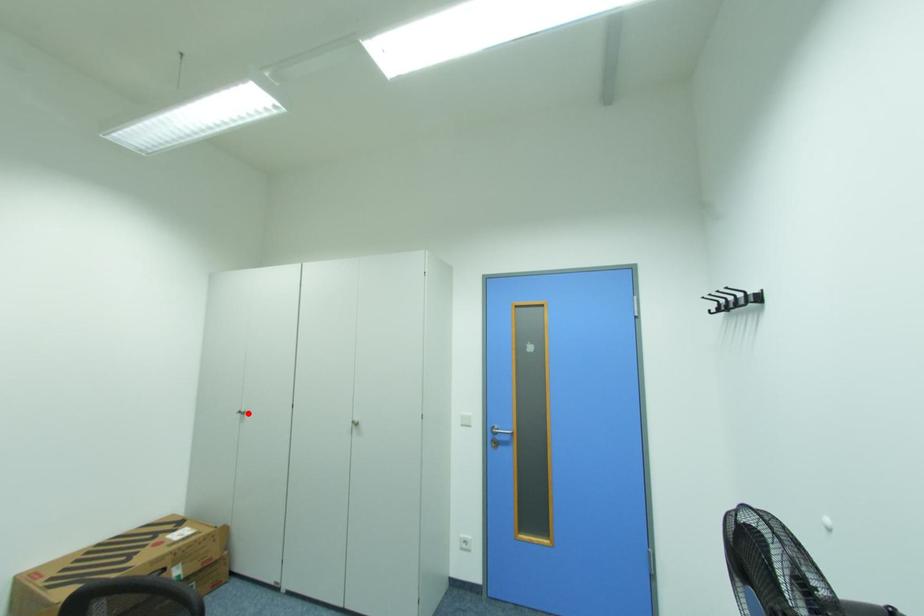
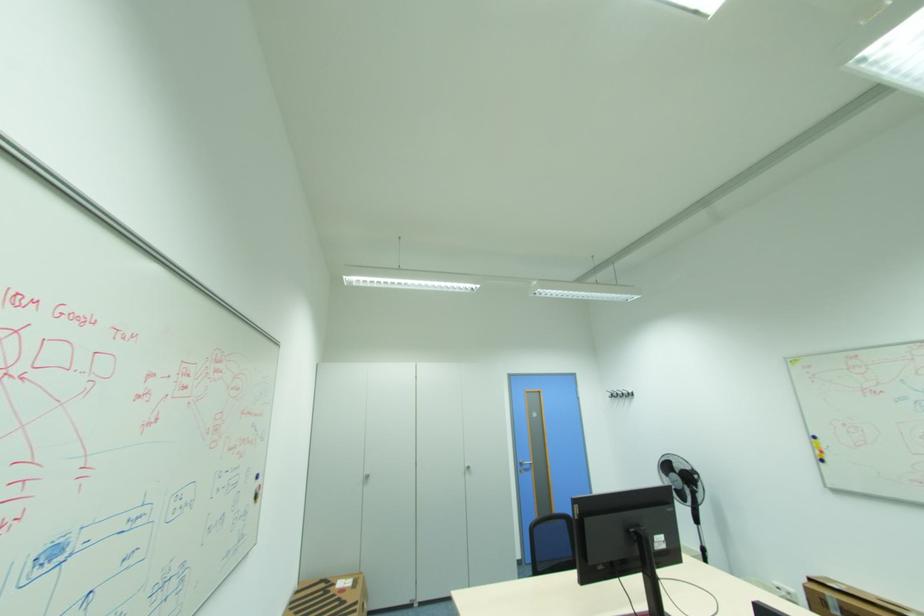
In the second image, find the point that corresponds to the highlighted location in the first image.

(372, 477)